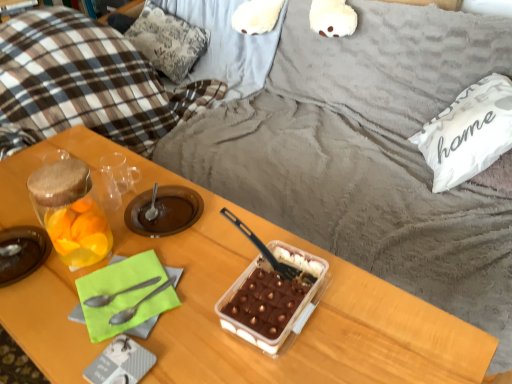
Question: Looking at the image, does wooden table at center seem bigger or smaller compared to translucent plastic tray at center, the first snack when ordered from right to left?

Choices:
 (A) big
 (B) small

Answer: (A)

Question: Is wooden table at center inside or outside of translucent plastic tray at center, the 2th snack positioned from the left?

Choices:
 (A) outside
 (B) inside

Answer: (A)

Question: Which of these objects is positioned farthest from the translucent glass jar at left, the first snack in the left-to-right sequence?

Choices:
 (A) black plastic spoon at center, the first spoon positioned from the right
 (B) metallic silver spoon at lower left, acting as the first spoon starting from the left
 (C) wooden table at center
 (D) translucent glass jar at left
 (E) silver metallic spoon at center, the second spoon when ordered from left to right

Answer: (A)

Question: Based on their relative distances, which object is nearer to the white fabric pillow at upper right, which is the 2th pillow in left-to-right order?

Choices:
 (A) plaid fabric pillow at upper left, positioned as the 2th pillow in front-to-back order
 (B) wooden table at center
 (C) translucent glass jar at left
 (D) silver metallic spoon at center, acting as the 2th spoon starting from the right
 (E) translucent glass jar at left, the first snack in the left-to-right sequence

Answer: (B)